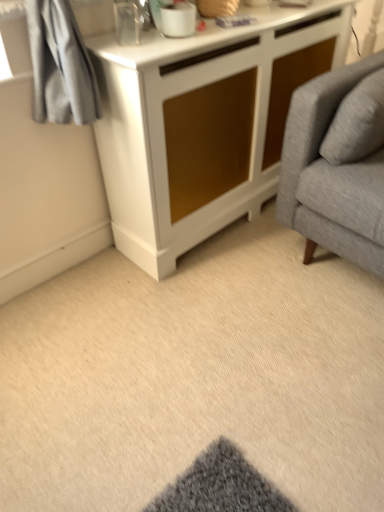
Question: Does point (16, 397) appear closer or farther from the camera than point (163, 5)?

Choices:
 (A) farther
 (B) closer

Answer: (A)

Question: Is beige carpet at lower center to the left or to the right of white glossy mug at upper center in the image?

Choices:
 (A) left
 (B) right

Answer: (B)

Question: Estimate the real-world distances between objects in this image. Which object is closer to the white textured cabinet at center?

Choices:
 (A) white glossy mug at upper center
 (B) beige carpet at lower center

Answer: (A)

Question: Which object is the farthest from the white textured cabinet at center?

Choices:
 (A) white glossy mug at upper center
 (B) beige carpet at lower center

Answer: (B)